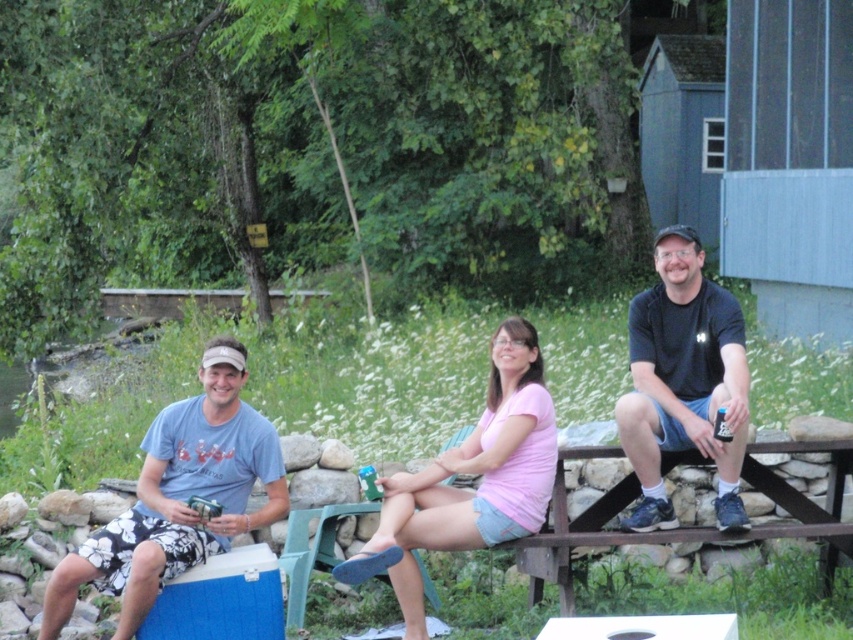
Does blue cotton shirt at left lie behind pink cotton shirt at center?

That is True.

Is point (103, 588) positioned behind point (520, 317)?

No, it is in front of (520, 317).

The width and height of the screenshot is (853, 640). Identify the location of blue cotton shirt at left. (178, 497).

Can you confirm if black matte shirt at center is positioned to the right of pink cotton shirt at center?

Indeed, black matte shirt at center is positioned on the right side of pink cotton shirt at center.

In the scene shown: Does black matte shirt at center have a smaller size compared to pink cotton shirt at center?

Correct, black matte shirt at center occupies less space than pink cotton shirt at center.

The width and height of the screenshot is (853, 640). Describe the element at coordinates (683, 380) in the screenshot. I see `black matte shirt at center` at that location.

Where is `black matte shirt at center`? black matte shirt at center is located at coordinates (683, 380).

Is point (187, 545) closer to camera compared to point (735, 412)?

No, it is behind (735, 412).

This screenshot has width=853, height=640. Describe the element at coordinates (178, 497) in the screenshot. I see `blue cotton shirt at left` at that location.

Is point (236, 522) in front of point (682, 433)?

That is True.

This screenshot has width=853, height=640. What are the coordinates of `blue cotton shirt at left` in the screenshot? It's located at (178, 497).